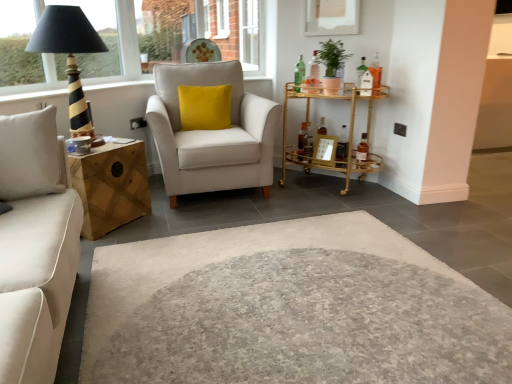
Where is `yellow velvet pillow at center`? The width and height of the screenshot is (512, 384). yellow velvet pillow at center is located at coordinates (204, 107).

Where is `white glass window frame at upper center, acting as the first window frame starting from the back`? This screenshot has height=384, width=512. white glass window frame at upper center, acting as the first window frame starting from the back is located at coordinates (249, 34).

This screenshot has width=512, height=384. I want to click on black plastic lampshade at upper left, the 1th window frame when ordered from left to right, so click(x=124, y=45).

From a real-world perspective, between striped wood table lamp at left and light beige fabric armchair at center, who is vertically higher?

striped wood table lamp at left, from a real-world perspective.

Considering the positions of objects striped wood table lamp at left and light beige fabric armchair at center in the image provided, who is behind, striped wood table lamp at left or light beige fabric armchair at center?

light beige fabric armchair at center is further from the camera.

In terms of width, does striped wood table lamp at left look wider or thinner when compared to light beige fabric armchair at center?

In the image, striped wood table lamp at left appears to be more narrow than light beige fabric armchair at center.

Considering the positions of objects striped wood table lamp at left and green matte plant at upper right in the image provided, who is in front, striped wood table lamp at left or green matte plant at upper right?

striped wood table lamp at left is more forward.

Measure the distance from striped wood table lamp at left to green matte plant at upper right.

striped wood table lamp at left is 1.62 meters from green matte plant at upper right.

From the image's perspective, is striped wood table lamp at left under green matte plant at upper right?

Correct, striped wood table lamp at left appears lower than green matte plant at upper right in the image.

In the scene shown: Would you say striped wood table lamp at left is to the left or to the right of green matte plant at upper right in the picture?

striped wood table lamp at left is positioned on green matte plant at upper right's left side.

Which of these two, woodenwoodennightstand at left or green matte plant at upper right, is bigger?

woodenwoodennightstand at left.

From the image's perspective, which one is positioned higher, woodenwoodennightstand at left or green matte plant at upper right?

green matte plant at upper right appears higher in the image.

Would you say woodenwoodennightstand at left is a long distance from green matte plant at upper right?

Yes, woodenwoodennightstand at left is far from green matte plant at upper right.

Based on the photo, can you confirm if woodenwoodennightstand at left is taller than green matte plant at upper right?

Indeed, woodenwoodennightstand at left has a greater height compared to green matte plant at upper right.

From the image's perspective, is yellow velvet pillow at center above or below gold metallic bar cart at right?

From the image's perspective, yellow velvet pillow at center appears above gold metallic bar cart at right.

Can you confirm if yellow velvet pillow at center is smaller than gold metallic bar cart at right?

Correct, yellow velvet pillow at center occupies less space than gold metallic bar cart at right.

Is point (197, 90) positioned in front of point (368, 90)?

No, (197, 90) is further to viewer.

What's the angular difference between light beige fabric armchair at center and yellow velvet pillow at center's facing directions?

light beige fabric armchair at center and yellow velvet pillow at center are facing 20.7 degrees away from each other.

Does light beige fabric armchair at center turn towards yellow velvet pillow at center?

Yes, light beige fabric armchair at center is aimed at yellow velvet pillow at center.

Considering the positions of objects light beige fabric armchair at center and yellow velvet pillow at center in the image provided, who is more to the left, light beige fabric armchair at center or yellow velvet pillow at center?

yellow velvet pillow at center is more to the left.

Considering the sizes of light beige fabric armchair at center and yellow velvet pillow at center in the image, is light beige fabric armchair at center taller or shorter than yellow velvet pillow at center?

In the image, light beige fabric armchair at center appears to be taller than yellow velvet pillow at center.

Does striped wood table lamp at left contain gold metallic bar cart at right?

No.

Where is `table lamp that appears above the gold metallic bar cart at right (from the image's perspective)`? This screenshot has height=384, width=512. table lamp that appears above the gold metallic bar cart at right (from the image's perspective) is located at coordinates (69, 55).

Looking at this image, which point is more forward, (x=69, y=13) or (x=372, y=154)?

Point (x=69, y=13)

How distant is striped wood table lamp at left from gold metallic bar cart at right?

striped wood table lamp at left and gold metallic bar cart at right are 1.71 meters apart.

Is wooden picture frame at center bigger than black plastic lampshade at upper left, acting as the 2th window frame starting from the back?

No.

Does point (332, 140) come farther from viewer compared to point (138, 62)?

No, it is in front of (138, 62).

This screenshot has height=384, width=512. In order to click on picture frame below the black plastic lampshade at upper left, the first window frame in the front-to-back sequence (from a real-world perspective) in this screenshot , I will do `click(325, 150)`.

What's the angular difference between wooden picture frame at center and black plastic lampshade at upper left, arranged as the second window frame when viewed from the right,'s facing directions?

There is a 95.2-degree angle between the facing directions of wooden picture frame at center and black plastic lampshade at upper left, arranged as the second window frame when viewed from the right.

The width and height of the screenshot is (512, 384). Find the location of `chair on the right of striped wood table lamp at left`. chair on the right of striped wood table lamp at left is located at coordinates (212, 133).

Find the location of a particular element. table lamp that appears below the green matte plant at upper right (from the image's perspective) is located at coordinates (69, 55).

Based on their spatial positions, is white glass window frame at upper center, placed as the second window frame when sorted from front to back, or light beige fabric armchair at center closer to striped wood table lamp at left?

Among the two, light beige fabric armchair at center is located nearer to striped wood table lamp at left.

Consider the image. From the image, which object appears to be farther from black plastic lampshade at upper left, arranged as the second window frame when viewed from the right, wooden picture frame at center or striped wood table lamp at left?

The object further to black plastic lampshade at upper left, arranged as the second window frame when viewed from the right, is wooden picture frame at center.

Considering their positions, is clear glass window at upper center positioned closer to striped wood table lamp at left than gold metallic bar cart at right?

The object closer to striped wood table lamp at left is gold metallic bar cart at right.

Estimate the real-world distances between objects in this image. Which object is closer to clear glass window at upper center, wooden picture frame at center or green matte plant at upper right?

Among the two, green matte plant at upper right is located nearer to clear glass window at upper center.

From the picture: Based on their spatial positions, is light beige fabric armchair at center or clear glass window at upper center further from white glass window frame at upper center, acting as the first window frame starting from the right?

light beige fabric armchair at center is positioned further to the anchor white glass window frame at upper center, acting as the first window frame starting from the right.

From the image, which object appears to be nearer to yellow velvet pillow at center, black plastic lampshade at upper left, acting as the 2th window frame starting from the back, or striped wood table lamp at left?

black plastic lampshade at upper left, acting as the 2th window frame starting from the back, is positioned closer to the anchor yellow velvet pillow at center.

Looking at the image, which one is located closer to wooden picture frame at center, light beige fabric armchair at center or black plastic lampshade at upper left, the first window frame in the front-to-back sequence?

The object closer to wooden picture frame at center is light beige fabric armchair at center.

Based on their spatial positions, is striped wood table lamp at left or gold metallic bar cart at right closer to wooden picture frame at center?

Among the two, gold metallic bar cart at right is located nearer to wooden picture frame at center.

Image resolution: width=512 pixels, height=384 pixels. Identify the location of chair located between woodenwoodennightstand at left and green matte plant at upper right in the left-right direction. (212, 133).

The width and height of the screenshot is (512, 384). Find the location of `shelf between green matte plant at upper right and wooden picture frame at center from top to bottom`. shelf between green matte plant at upper right and wooden picture frame at center from top to bottom is located at coordinates (345, 136).

This screenshot has height=384, width=512. I want to click on nightstand between striped wood table lamp at left and yellow velvet pillow at center along the z-axis, so click(111, 186).

Where is `nightstand between striped wood table lamp at left and gold metallic bar cart at right in the horizontal direction`? This screenshot has width=512, height=384. nightstand between striped wood table lamp at left and gold metallic bar cart at right in the horizontal direction is located at coordinates (111, 186).